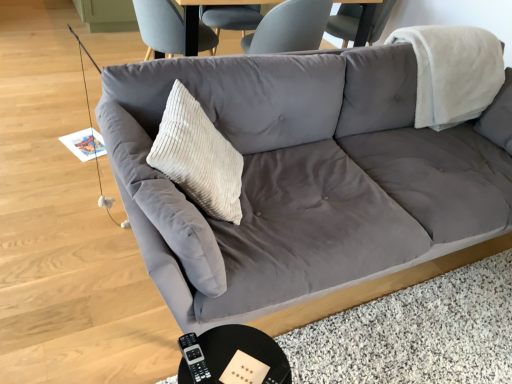
Question: From the image's perspective, does black glossy round table at lower center appear higher than beige corduroy pillow at center?

Choices:
 (A) no
 (B) yes

Answer: (A)

Question: Considering the relative sizes of black glossy round table at lower center and beige corduroy pillow at center in the image provided, is black glossy round table at lower center taller than beige corduroy pillow at center?

Choices:
 (A) no
 (B) yes

Answer: (A)

Question: Is black glossy round table at lower center outside of beige corduroy pillow at center?

Choices:
 (A) yes
 (B) no

Answer: (A)

Question: Is black glossy round table at lower center positioned in front of beige corduroy pillow at center?

Choices:
 (A) yes
 (B) no

Answer: (A)

Question: Can you confirm if black glossy round table at lower center is bigger than beige corduroy pillow at center?

Choices:
 (A) yes
 (B) no

Answer: (B)

Question: Is black glossy round table at lower center thinner than beige corduroy pillow at center?

Choices:
 (A) no
 (B) yes

Answer: (A)

Question: Does beige corduroy pillow at center have a lesser height compared to suede gray couch at center?

Choices:
 (A) yes
 (B) no

Answer: (A)

Question: Is beige corduroy pillow at center further to the viewer compared to suede gray couch at center?

Choices:
 (A) yes
 (B) no

Answer: (A)

Question: Considering the relative sizes of beige corduroy pillow at center and suede gray couch at center in the image provided, is beige corduroy pillow at center thinner than suede gray couch at center?

Choices:
 (A) no
 (B) yes

Answer: (B)

Question: Does beige corduroy pillow at center have a larger size compared to suede gray couch at center?

Choices:
 (A) yes
 (B) no

Answer: (B)

Question: Is there a large distance between beige corduroy pillow at center and suede gray couch at center?

Choices:
 (A) yes
 (B) no

Answer: (B)

Question: Is beige corduroy pillow at center in contact with suede gray couch at center?

Choices:
 (A) yes
 (B) no

Answer: (B)

Question: Is suede gray couch at center completely or partially outside of black glossy round table at lower center?

Choices:
 (A) yes
 (B) no

Answer: (A)